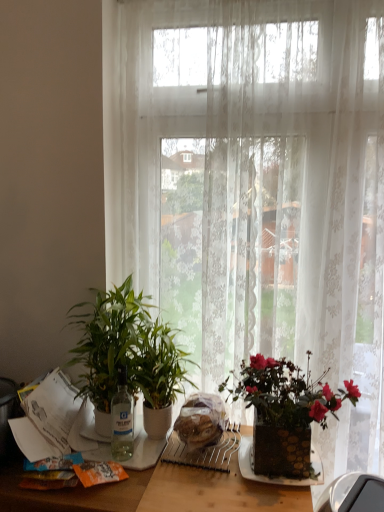
Where is `free location in front of green glossy plant at center, acting as the 1th houseplant starting from the right`? This screenshot has width=384, height=512. free location in front of green glossy plant at center, acting as the 1th houseplant starting from the right is located at coordinates (154, 486).